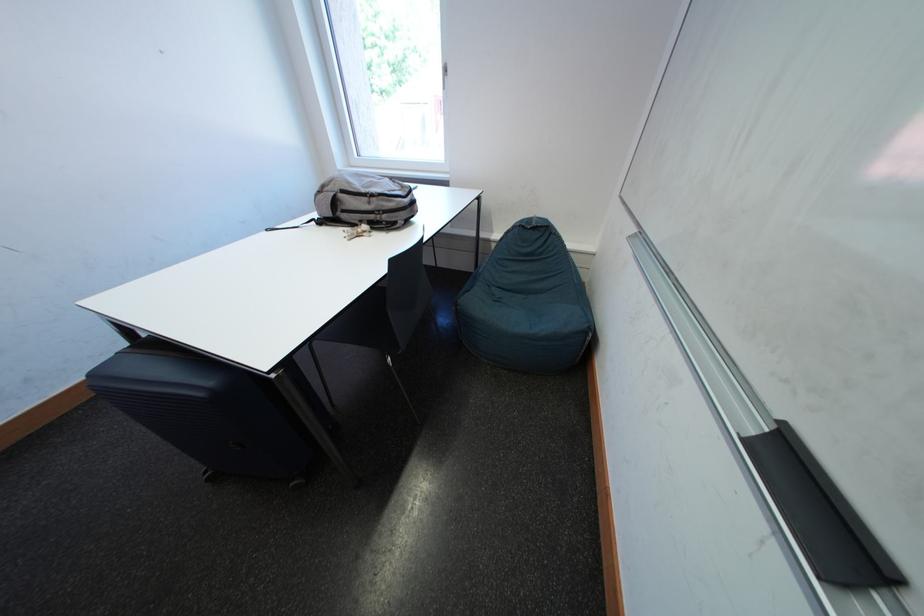
I want to click on gray backpack handle, so pos(416,204).